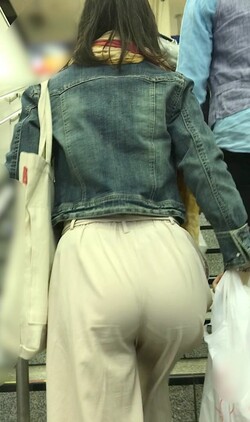
Find the location of `stairs`. stairs is located at coordinates (210, 231), (210, 252), (201, 363), (192, 382), (35, 371), (35, 393).